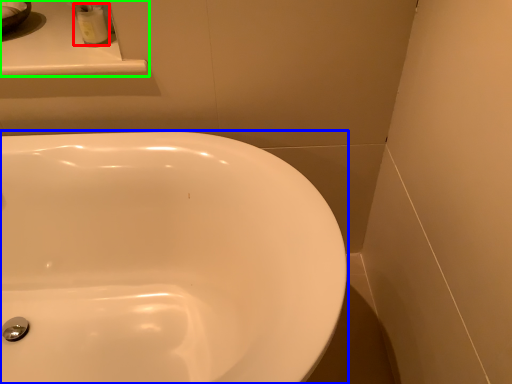
Question: Which is nearer to the toiletry (highlighted by a red box)? sink (highlighted by a blue box) or counter top (highlighted by a green box).

Choices:
 (A) sink
 (B) counter top

Answer: (B)